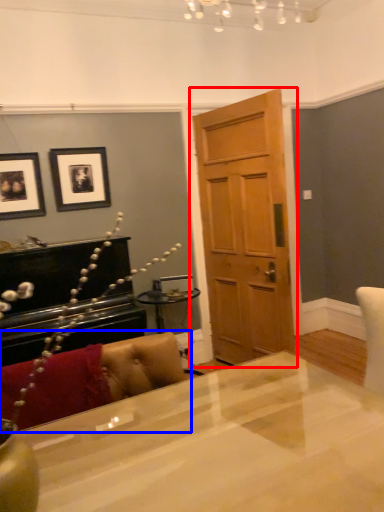
Question: Which object appears farthest to the camera in this image, door (highlighted by a red box) or couch (highlighted by a blue box)?

Choices:
 (A) door
 (B) couch

Answer: (A)